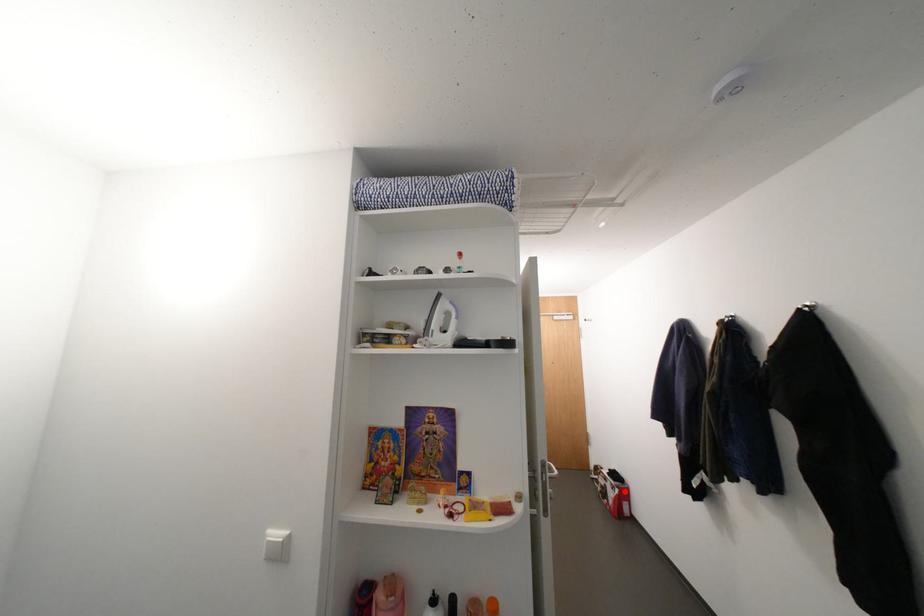
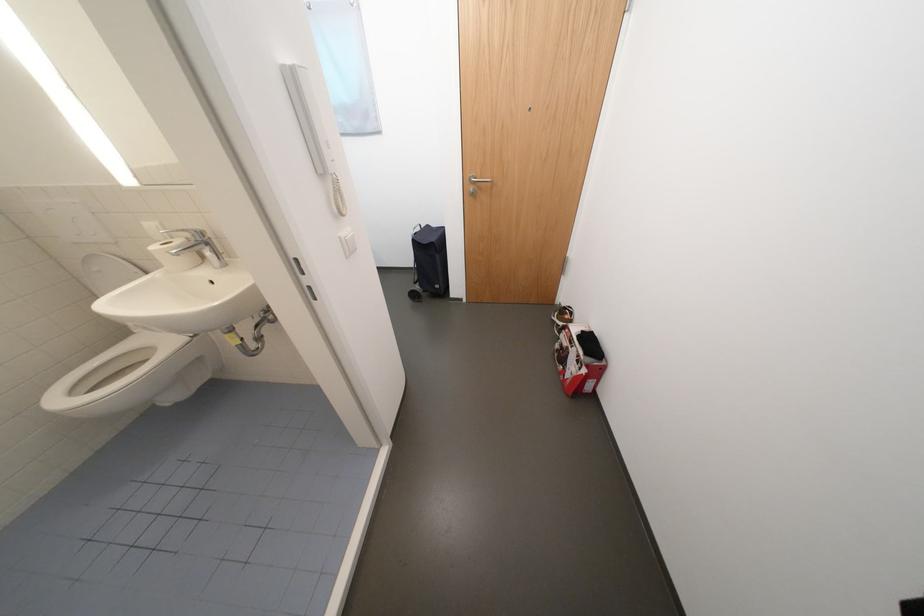
Question: I am providing you with two images of the same scene from different viewpoints. Given a red point in image1, look at the same physical point in image2. Is it:

Choices:
 (A) Closer to the viewpoint
 (B) Farther from the viewpoint

Answer: (A)